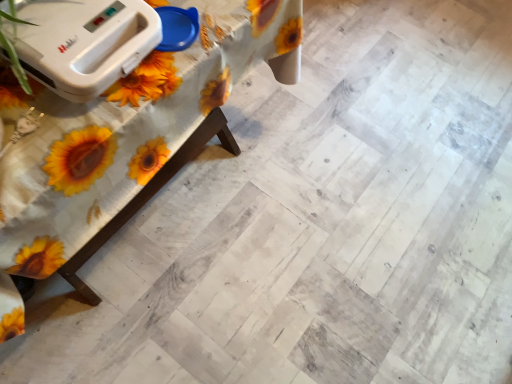
Question: In terms of size, does white wood table at upper left appear bigger or smaller than white plastic toaster at upper left?

Choices:
 (A) small
 (B) big

Answer: (B)

Question: In the image, is white wood table at upper left positioned in front of or behind white plastic toaster at upper left?

Choices:
 (A) behind
 (B) front

Answer: (B)

Question: From a real-world perspective, is white wood table at upper left positioned above or below white plastic toaster at upper left?

Choices:
 (A) below
 (B) above

Answer: (A)

Question: Considering the positions of white plastic toaster at upper left and white wood table at upper left in the image, is white plastic toaster at upper left wider or thinner than white wood table at upper left?

Choices:
 (A) wide
 (B) thin

Answer: (B)

Question: Is point (134, 49) closer or farther from the camera than point (164, 173)?

Choices:
 (A) closer
 (B) farther

Answer: (A)

Question: From the image's perspective, relative to white wood table at upper left, is white plastic toaster at upper left above or below?

Choices:
 (A) below
 (B) above

Answer: (B)

Question: Which is correct: white plastic toaster at upper left is inside white wood table at upper left, or outside of it?

Choices:
 (A) outside
 (B) inside

Answer: (A)